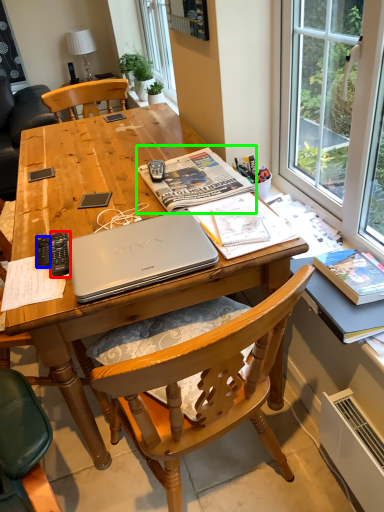
Question: Which is nearer to the remote control (highlighted by a red box)? remote control (highlighted by a blue box) or magazine (highlighted by a green box).

Choices:
 (A) remote control
 (B) magazine

Answer: (A)